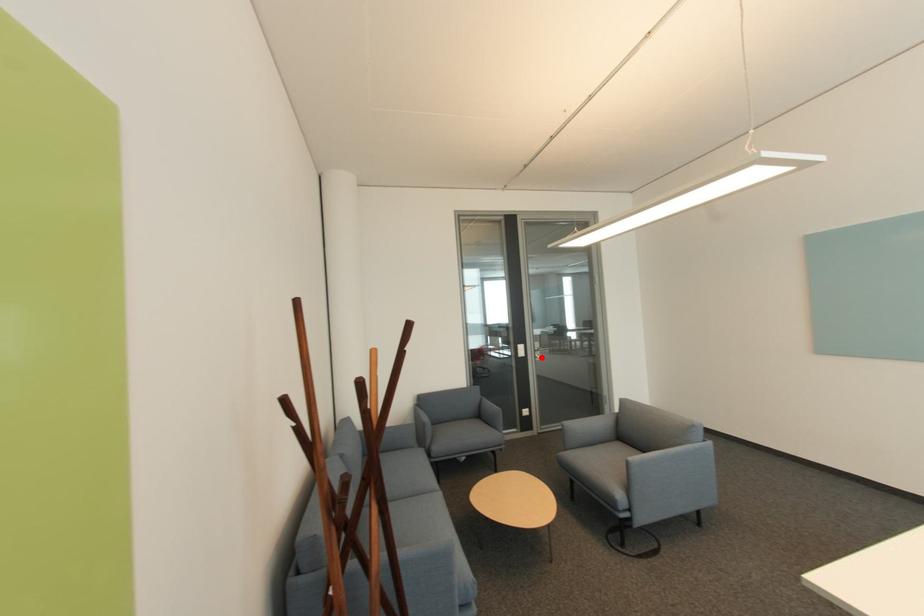
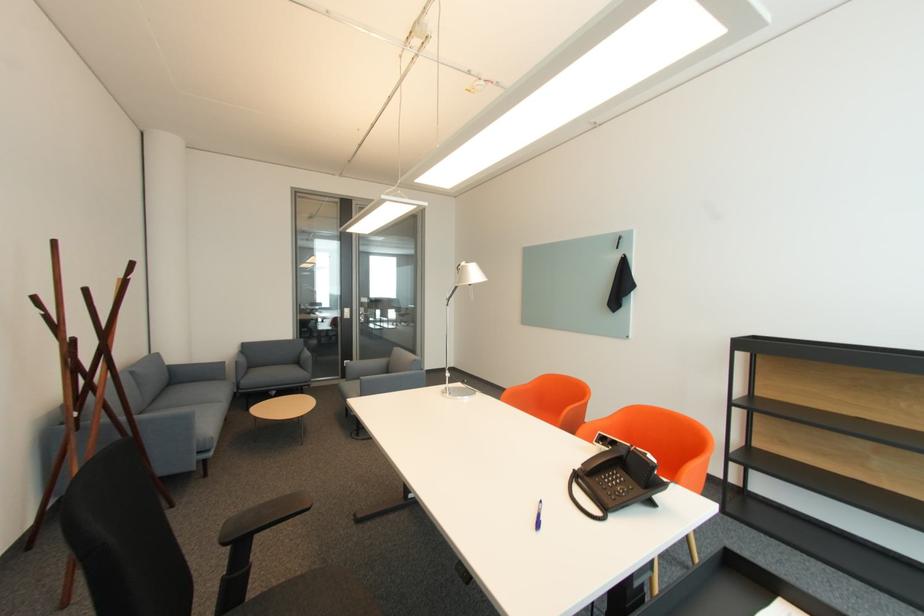
Find the pixel in the second image that matches the highlighted location in the first image.

(367, 320)